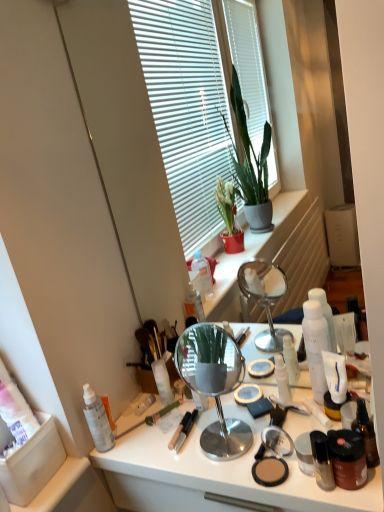
This screenshot has width=384, height=512. What are the coordinates of `vacant area that lies between matte brown compact at lower center and transparent plastic spray bottle at left, the 1th toiletry in the left-to-right sequence` in the screenshot? It's located at click(186, 461).